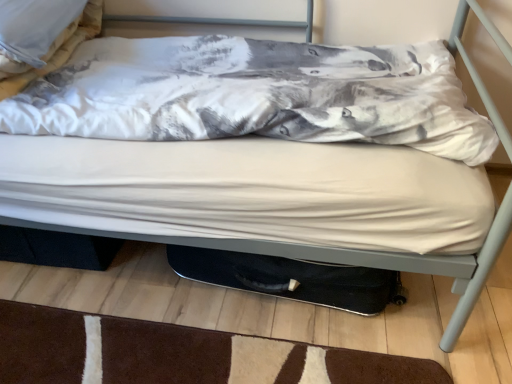
The image size is (512, 384). What are the coordinates of `blank space situated above brown plush rug at lower center (from a real-world perspective)` in the screenshot? It's located at (179, 353).